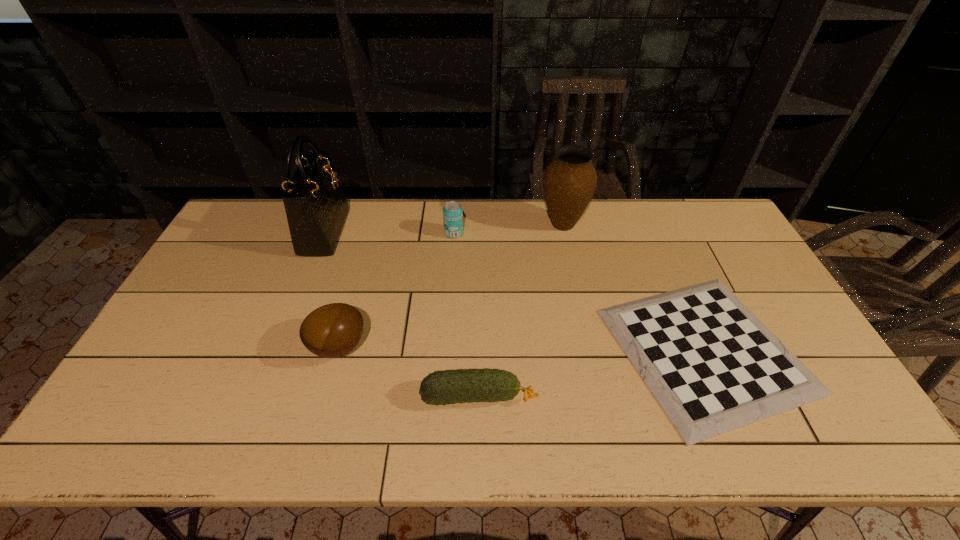
Locate an element on the screen. Image resolution: width=960 pixels, height=540 pixels. free point located 0.200m on the left of the fifth object from right to left is located at coordinates (235, 347).

Image resolution: width=960 pixels, height=540 pixels. Find the location of `free location located 0.060m at the blossom end of the cucumber`. free location located 0.060m at the blossom end of the cucumber is located at coordinates (561, 396).

Locate an element on the screen. This screenshot has height=540, width=960. free space located on the back of the shortest object is located at coordinates (664, 255).

Locate an element on the screen. handbag present at the far edge is located at coordinates (316, 208).

This screenshot has height=540, width=960. What are the coordinates of `urn that is at the far edge` in the screenshot? It's located at (569, 182).

Where is `beer can located at the far edge`? The image size is (960, 540). beer can located at the far edge is located at coordinates (452, 211).

The image size is (960, 540). Find the location of `cucumber located in the near edge section of the desktop`. cucumber located in the near edge section of the desktop is located at coordinates (445, 387).

Where is `chessboard at the near edge`? This screenshot has height=540, width=960. chessboard at the near edge is located at coordinates (712, 365).

Image resolution: width=960 pixels, height=540 pixels. What are the coordinates of `object that is at the right edge` in the screenshot? It's located at (712, 365).

Locate an element on the screen. object at the near right corner is located at coordinates (712, 365).